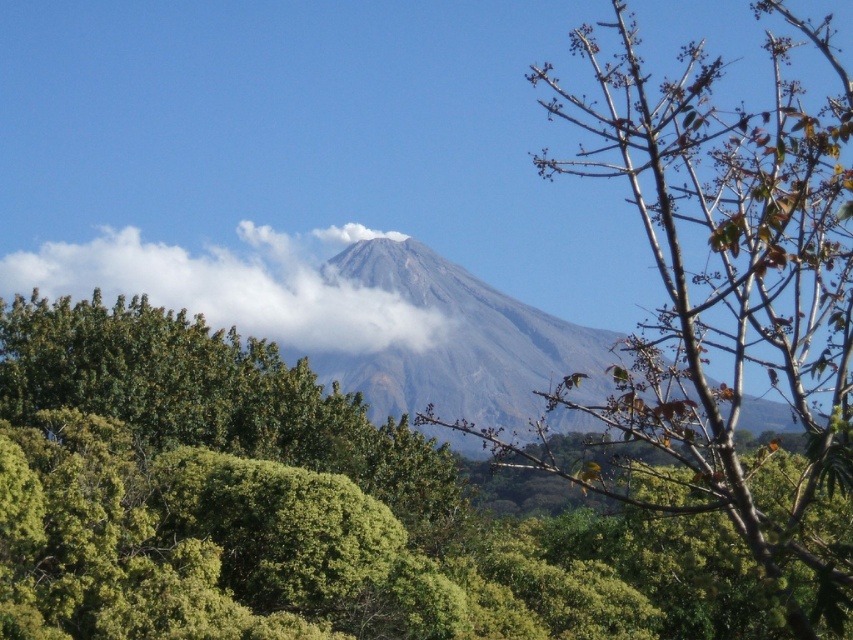
Is point (154, 564) closer to viewer compared to point (86, 272)?

Yes, point (154, 564) is in front of point (86, 272).

Who is taller, green leafy tree at center or white fluffy cloud at upper center?

With more height is green leafy tree at center.

I want to click on green leafy tree at center, so click(294, 508).